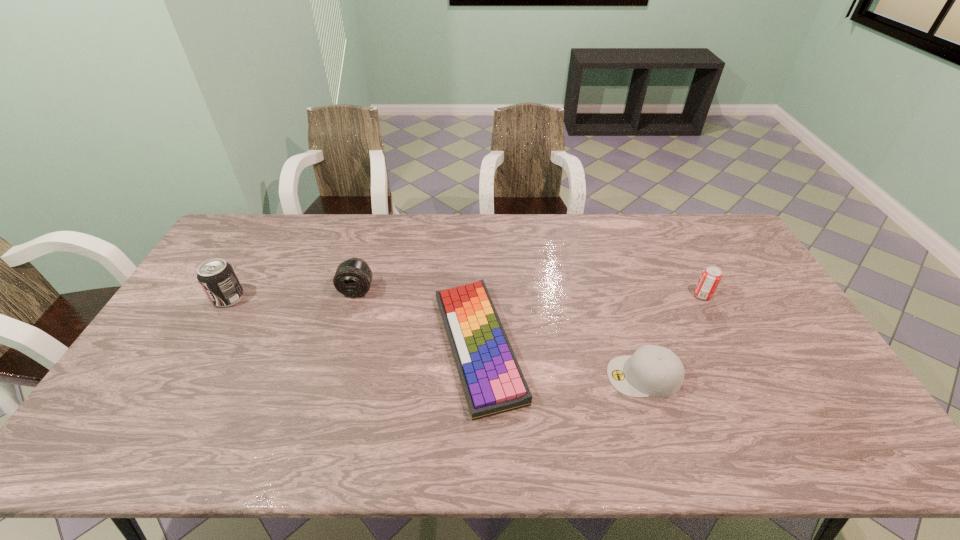
You are a GUI agent. You are given a task and a screenshot of the screen. Output one action in this format:
    pyautogui.click(x=<x>, y=<y>)
    Task: Click on the free space at the right edge
    The width and height of the screenshot is (960, 540).
    Given the screenshot: What is the action you would take?
    tap(777, 310)

At what (x,y) coordinates should I click in order to perform the action: click on free space at the near left corner. Please return your answer as a coordinate pair (x, y). Looking at the image, I should click on (82, 448).

This screenshot has width=960, height=540. Find the location of `free spot between the leftmost object and the fourth object from right to left`. free spot between the leftmost object and the fourth object from right to left is located at coordinates (293, 294).

At what (x,y) coordinates should I click in order to perform the action: click on free space between the computer keyboard and the cap. Please return your answer as a coordinate pair (x, y). Image resolution: width=960 pixels, height=540 pixels. Looking at the image, I should click on (562, 361).

You are a GUI agent. You are given a task and a screenshot of the screen. Output one action in this format:
    pyautogui.click(x=<x>, y=<y>)
    Task: Click on the vacant area that lies between the computer keyboard and the left soda can
    This screenshot has width=960, height=540.
    Given the screenshot: What is the action you would take?
    pyautogui.click(x=353, y=322)

At what (x,y) coordinates should I click in order to perform the action: click on vacant space that is in between the right soda can and the telephoto lens. Please return your answer as a coordinate pair (x, y). The image size is (960, 540). Looking at the image, I should click on point(530,293).

This screenshot has width=960, height=540. I want to click on free point between the telephoto lens and the taller soda can, so click(x=293, y=294).

You are a GUI agent. You are given a task and a screenshot of the screen. Output one action in this format:
    pyautogui.click(x=<x>, y=<y>)
    Task: Click on the free point between the telephoto lens and the taller soda can
    The width and height of the screenshot is (960, 540).
    Given the screenshot: What is the action you would take?
    pyautogui.click(x=293, y=294)

Locate an element on the screen. This screenshot has width=960, height=540. empty space between the shorter soda can and the computer keyboard is located at coordinates (590, 321).

Locate an element on the screen. empty location between the second object from left to right and the shortest object is located at coordinates (418, 318).